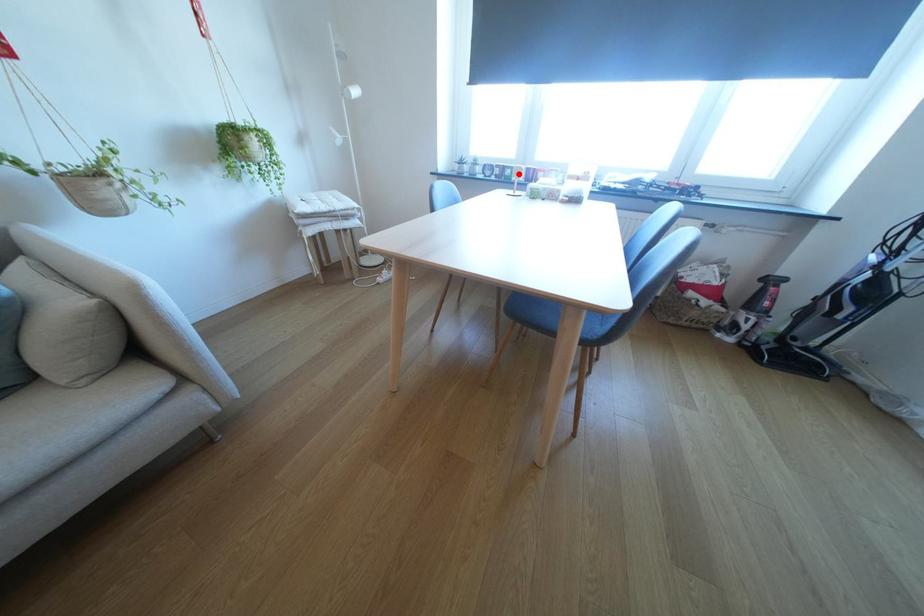
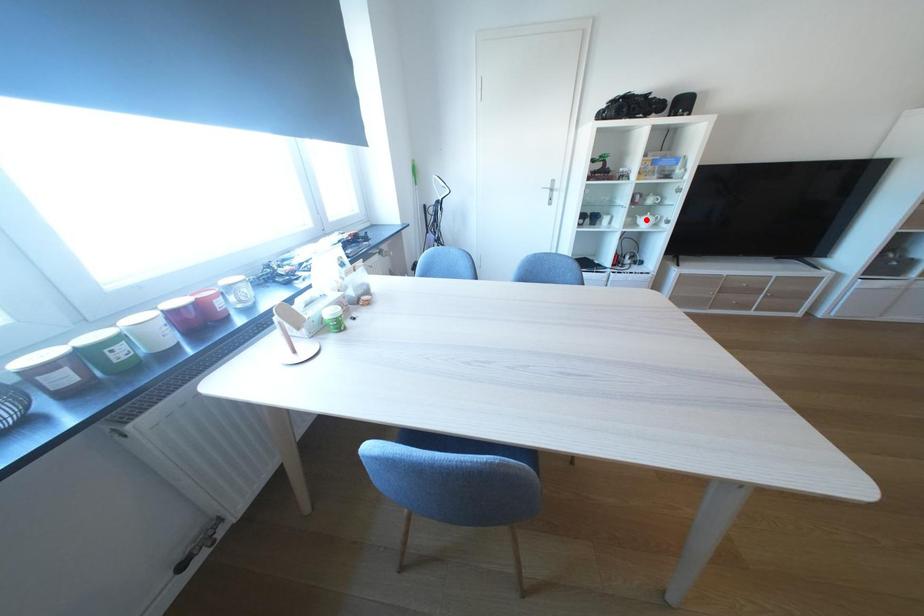
I am providing you with two images of the same scene from different viewpoints. A red point is marked on the first image and another point is marked on the second image. Is the red point in image1 aligned with the point shown in image2?

No